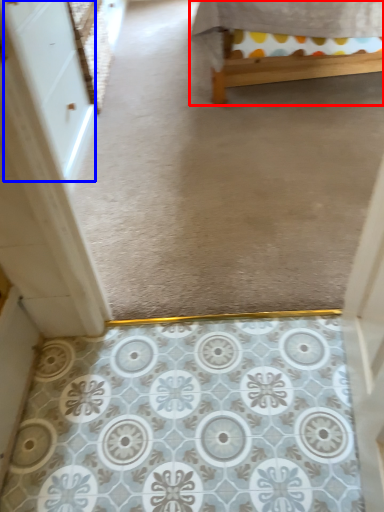
Question: Which object appears closest to the camera in this image, furniture (highlighted by a red box) or screen door (highlighted by a blue box)?

Choices:
 (A) furniture
 (B) screen door

Answer: (B)